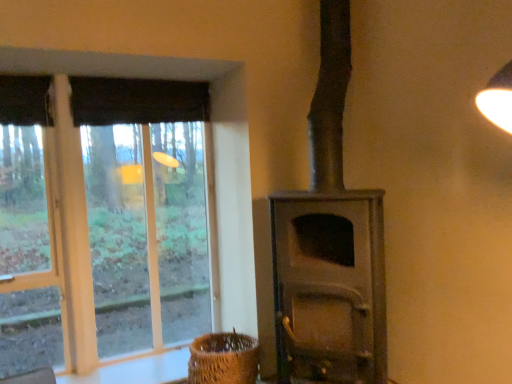
The width and height of the screenshot is (512, 384). What do you see at coordinates (329, 245) in the screenshot?
I see `matte gray wood burning stove at center` at bounding box center [329, 245].

This screenshot has width=512, height=384. What do you see at coordinates (223, 359) in the screenshot?
I see `brown woven basket at lower center` at bounding box center [223, 359].

Find the location of `brown woven basket at lower center`. brown woven basket at lower center is located at coordinates (223, 359).

At what (x,y) coordinates should I click in order to perform the action: click on clear glass window at left. Please return your answer as a coordinate pair (x, y). Image resolution: width=512 pixels, height=384 pixels. Looking at the image, I should click on (205, 160).

I want to click on matte gray wood burning stove at center, so click(x=329, y=245).

Is clear glass window at left wider or thinner than matte gray wood burning stove at center?

Considering their sizes, clear glass window at left looks slimmer than matte gray wood burning stove at center.

Is clear glass window at left oriented away from matte gray wood burning stove at center?

No.

Do you think clear glass window at left is within matte gray wood burning stove at center, or outside of it?

clear glass window at left cannot be found inside matte gray wood burning stove at center.

Which of these two, clear glass window at left or matte gray wood burning stove at center, is smaller?

Smaller between the two is clear glass window at left.

Measure the distance from matte gray wood burning stove at center to brown woven basket at lower center.

matte gray wood burning stove at center is 63.86 centimeters away from brown woven basket at lower center.

Is matte gray wood burning stove at center not inside brown woven basket at lower center?

matte gray wood burning stove at center is positioned outside brown woven basket at lower center.

Is matte gray wood burning stove at center thinner than brown woven basket at lower center?

Incorrect, the width of matte gray wood burning stove at center is not less than that of brown woven basket at lower center.

Does matte gray wood burning stove at center have a smaller size compared to brown woven basket at lower center?

No.

Between brown woven basket at lower center and clear glass window at left, which one has smaller size?

With smaller size is brown woven basket at lower center.

Is brown woven basket at lower center behind clear glass window at left?

No, it is in front of clear glass window at left.

Find the location of a particular element. window behind the brown woven basket at lower center is located at coordinates (205, 160).

Is brown woven basket at lower center next to clear glass window at left?

No, brown woven basket at lower center is not with clear glass window at left.

Which is farther, (338,232) or (35,57)?

Point (35,57)

From a real-world perspective, is matte gray wood burning stove at center over clear glass window at left?

Correct, in the physical world, matte gray wood burning stove at center is higher than clear glass window at left.

Which of these two, matte gray wood burning stove at center or clear glass window at left, stands taller?

matte gray wood burning stove at center.

Is dark fabric curtain at upper left located within clear glass window at left?

That's correct, dark fabric curtain at upper left is inside clear glass window at left.

Is clear glass window at left positioned before dark fabric curtain at upper left?

Yes, it is in front of dark fabric curtain at upper left.

How many degrees apart are the facing directions of clear glass window at left and dark fabric curtain at upper left?

0.849 degrees separate the facing orientations of clear glass window at left and dark fabric curtain at upper left.

The height and width of the screenshot is (384, 512). I want to click on curtain behind the clear glass window at left, so click(x=137, y=101).

Can you confirm if brown woven basket at lower center is shorter than matte gray wood burning stove at center?

Correct, brown woven basket at lower center is not as tall as matte gray wood burning stove at center.

Is brown woven basket at lower center positioned with its back to matte gray wood burning stove at center?

No, brown woven basket at lower center's orientation is not away from matte gray wood burning stove at center.

Between brown woven basket at lower center and matte gray wood burning stove at center, which one appears on the left side from the viewer's perspective?

From the viewer's perspective, brown woven basket at lower center appears more on the left side.

Considering the relative sizes of brown woven basket at lower center and matte gray wood burning stove at center in the image provided, is brown woven basket at lower center wider than matte gray wood burning stove at center?

In fact, brown woven basket at lower center might be narrower than matte gray wood burning stove at center.

Is point (109, 104) farther from viewer compared to point (222, 381)?

That is True.

Is dark fabric curtain at upper left positioned behind brown woven basket at lower center?

Yes, the depth of dark fabric curtain at upper left is greater than that of brown woven basket at lower center.

Is dark fabric curtain at upper left placed right next to brown woven basket at lower center?

dark fabric curtain at upper left and brown woven basket at lower center are not in contact.

Is dark fabric curtain at upper left at the right side of brown woven basket at lower center?

Incorrect, dark fabric curtain at upper left is not on the right side of brown woven basket at lower center.

You are a GUI agent. You are given a task and a screenshot of the screen. Output one action in this format:
    pyautogui.click(x=<x>, y=<y>)
    Task: Click on the wood burning stove in front of the clear glass window at left
    Image resolution: width=512 pixels, height=384 pixels.
    Given the screenshot: What is the action you would take?
    pyautogui.click(x=329, y=245)

Identify the location of basket below the matte gray wood burning stove at center (from the image's perspective). This screenshot has height=384, width=512. (223, 359).

From the image, which object appears to be nearer to clear glass window at left, dark fabric curtain at upper left or brown woven basket at lower center?

Among the two, dark fabric curtain at upper left is located nearer to clear glass window at left.

Looking at the image, which one is located closer to dark fabric curtain at upper left, matte gray wood burning stove at center or clear glass window at left?

Among the two, clear glass window at left is located nearer to dark fabric curtain at upper left.

From the image, which object appears to be farther from brown woven basket at lower center, dark fabric curtain at upper left or matte gray wood burning stove at center?

dark fabric curtain at upper left lies further to brown woven basket at lower center than the other object.

Which object lies further to the anchor point brown woven basket at lower center, clear glass window at left or matte gray wood burning stove at center?

clear glass window at left is further to brown woven basket at lower center.

Considering their positions, is matte gray wood burning stove at center positioned closer to brown woven basket at lower center than clear glass window at left?

matte gray wood burning stove at center is positioned closer to the anchor brown woven basket at lower center.

Looking at the image, which one is located closer to clear glass window at left, matte gray wood burning stove at center or dark fabric curtain at upper left?

Based on the image, dark fabric curtain at upper left appears to be nearer to clear glass window at left.

Considering their positions, is matte gray wood burning stove at center positioned closer to dark fabric curtain at upper left than brown woven basket at lower center?

matte gray wood burning stove at center is positioned closer to the anchor dark fabric curtain at upper left.

From the image, which object appears to be farther from clear glass window at left, matte gray wood burning stove at center or brown woven basket at lower center?

Based on the image, matte gray wood burning stove at center appears to be further to clear glass window at left.

At what (x,y) coordinates should I click in order to perform the action: click on basket located between clear glass window at left and matte gray wood burning stove at center in the left-right direction. Please return your answer as a coordinate pair (x, y). Image resolution: width=512 pixels, height=384 pixels. Looking at the image, I should click on (223, 359).

Image resolution: width=512 pixels, height=384 pixels. Find the location of `window between dark fabric curtain at upper left and brown woven basket at lower center from top to bottom`. window between dark fabric curtain at upper left and brown woven basket at lower center from top to bottom is located at coordinates (205, 160).

Where is `wood burning stove between dark fabric curtain at upper left and brown woven basket at lower center in the vertical direction`? The width and height of the screenshot is (512, 384). wood burning stove between dark fabric curtain at upper left and brown woven basket at lower center in the vertical direction is located at coordinates (329, 245).

Locate an element on the screen. curtain between clear glass window at left and matte gray wood burning stove at center in the horizontal direction is located at coordinates (137, 101).